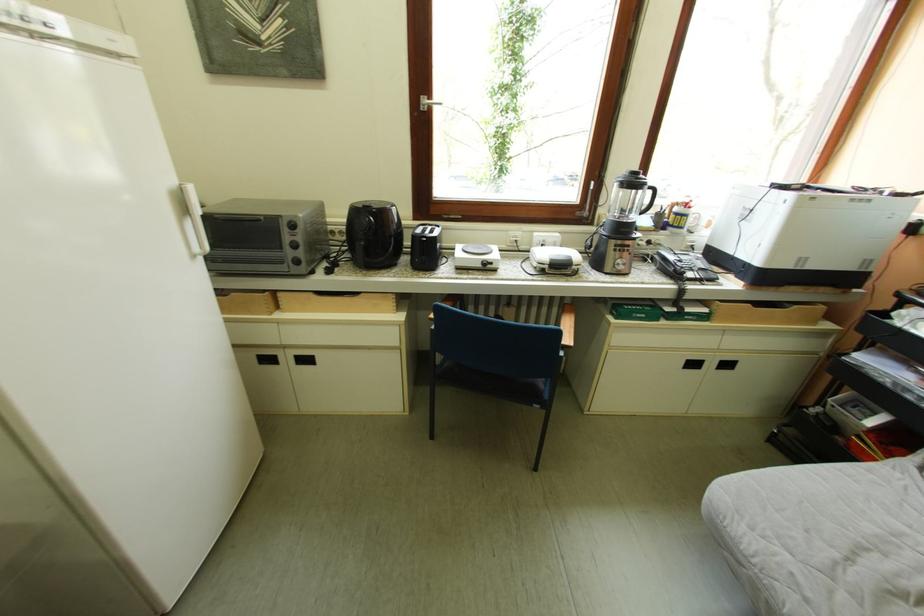
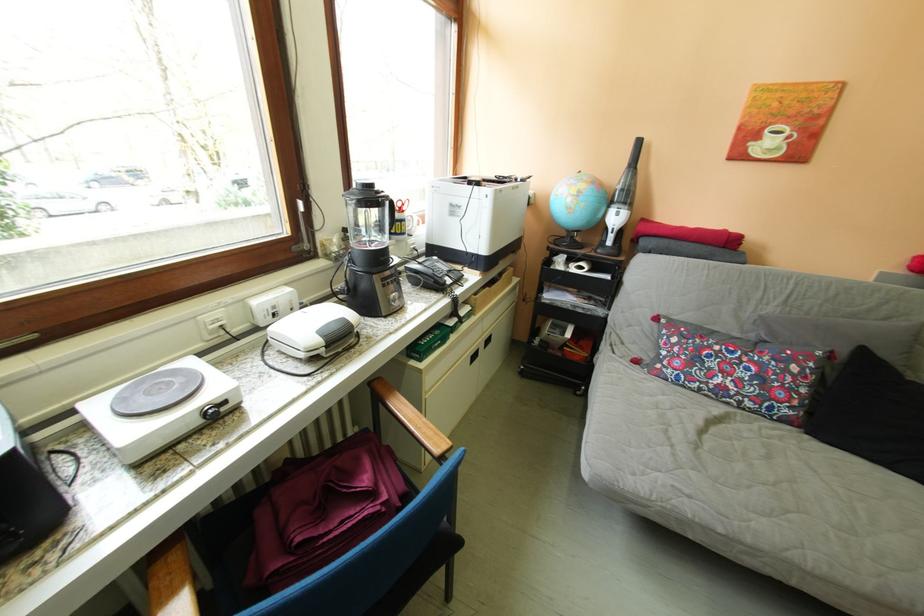
Find the pixel in the second image that matches the point at 627,265 in the first image.

(402, 304)